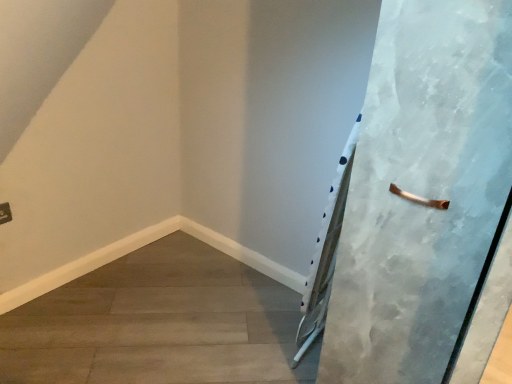
Question: Considering the relative sizes of smooth concrete floor at lower left and textured white door at right in the image provided, is smooth concrete floor at lower left bigger than textured white door at right?

Choices:
 (A) yes
 (B) no

Answer: (B)

Question: Is smooth concrete floor at lower left taller than textured white door at right?

Choices:
 (A) no
 (B) yes

Answer: (A)

Question: Is smooth concrete floor at lower left turned away from textured white door at right?

Choices:
 (A) yes
 (B) no

Answer: (B)

Question: Can you confirm if smooth concrete floor at lower left is wider than textured white door at right?

Choices:
 (A) yes
 (B) no

Answer: (A)

Question: Is smooth concrete floor at lower left at the right side of textured white door at right?

Choices:
 (A) yes
 (B) no

Answer: (B)

Question: Is smooth concrete floor at lower left beside textured white door at right?

Choices:
 (A) yes
 (B) no

Answer: (B)

Question: Can we say textured white door at right lies outside smooth concrete floor at lower left?

Choices:
 (A) yes
 (B) no

Answer: (A)

Question: Is textured white door at right turned away from smooth concrete floor at lower left?

Choices:
 (A) no
 (B) yes

Answer: (A)

Question: Can you confirm if textured white door at right is smaller than smooth concrete floor at lower left?

Choices:
 (A) yes
 (B) no

Answer: (B)

Question: From the image's perspective, is textured white door at right located beneath smooth concrete floor at lower left?

Choices:
 (A) no
 (B) yes

Answer: (A)

Question: Is textured white door at right wider than smooth concrete floor at lower left?

Choices:
 (A) yes
 (B) no

Answer: (B)

Question: Can you confirm if textured white door at right is positioned to the right of smooth concrete floor at lower left?

Choices:
 (A) yes
 (B) no

Answer: (A)

Question: Looking at the image, does textured white door at right seem bigger or smaller compared to smooth concrete floor at lower left?

Choices:
 (A) big
 (B) small

Answer: (A)